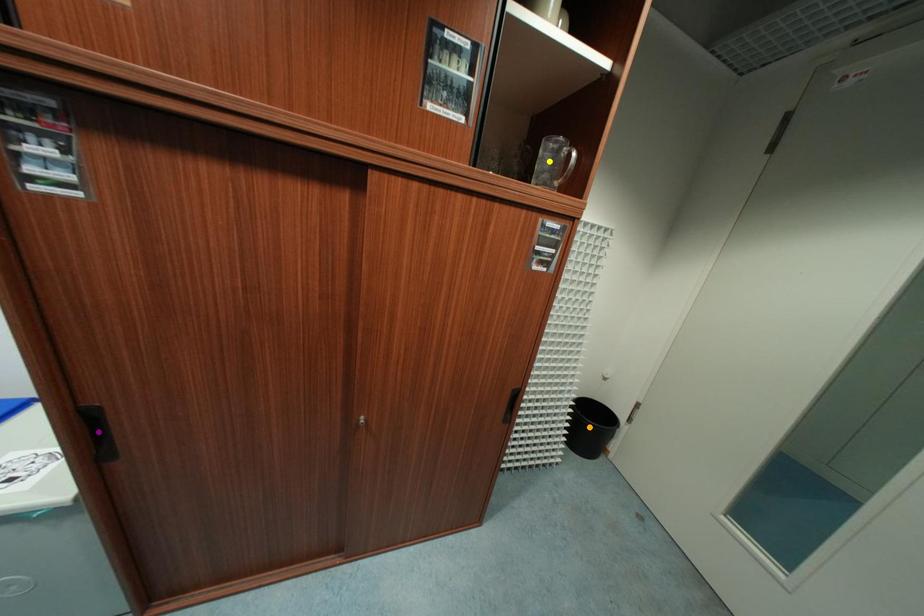
Order these from farthest to nearest:
A) yellow point
B) purple point
C) orange point

orange point → yellow point → purple point